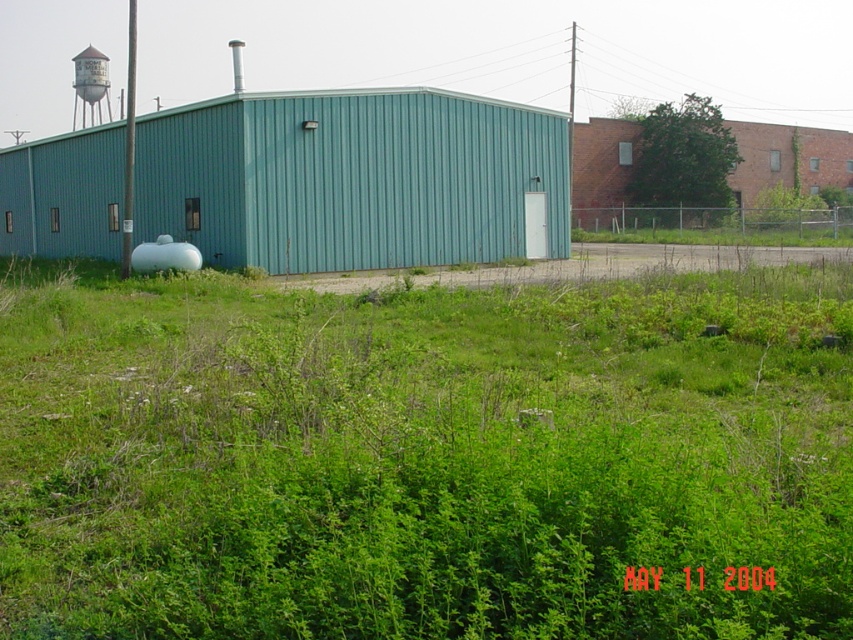
Based on the photo, you are standing at the entrance of the building and looking towards the small rectangular door. There is a point marked at coordinates (425, 458). What is located at that point?

The point at (425, 458) is where the green leafy grass at center is located.